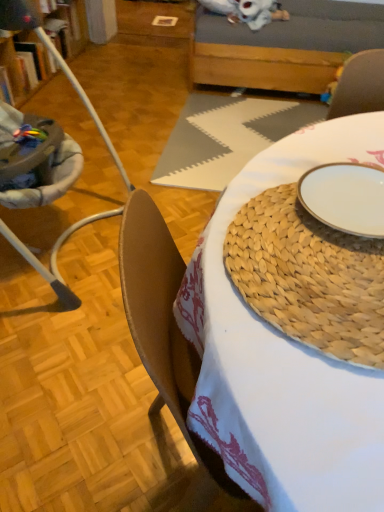
Image resolution: width=384 pixels, height=512 pixels. Identify the location of free region on the left part of white woven placemat at center. (116, 136).